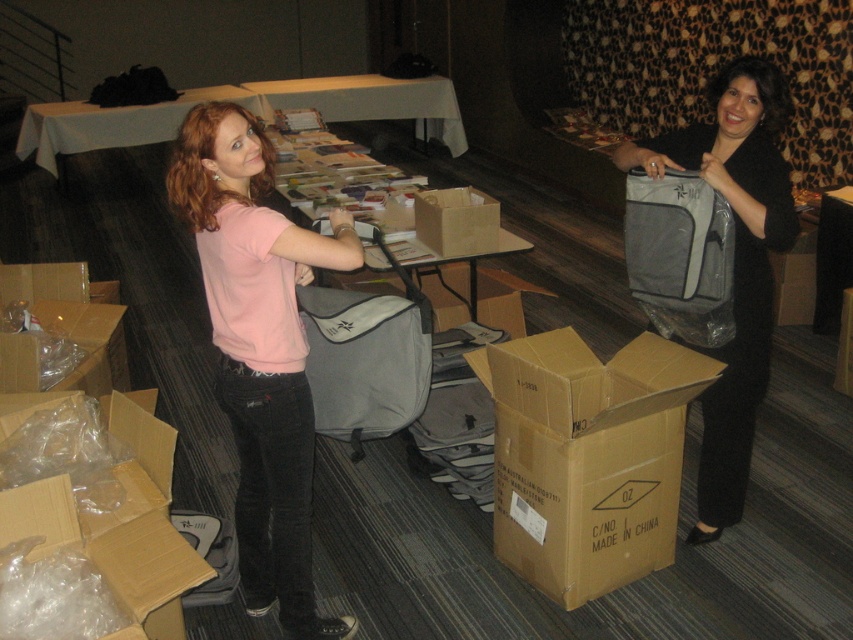
Which is more to the right, matte gray bag at center or gray fabric bag at right?

matte gray bag at center is more to the right.

The image size is (853, 640). I want to click on matte gray bag at center, so click(734, 260).

I want to click on matte gray bag at center, so click(x=734, y=260).

Between pink cotton shirt at center and brown cardboard box at center, which one is positioned higher?

brown cardboard box at center is higher up.

Can you confirm if pink cotton shirt at center is positioned above brown cardboard box at center?

No.

Locate an element on the screen. pink cotton shirt at center is located at coordinates (259, 348).

Does brown cardboard box at lower center lie behind white fabric table at upper center?

No, brown cardboard box at lower center is in front of white fabric table at upper center.

Who is more distant from viewer, (554, 486) or (303, 100)?

Positioned behind is point (303, 100).

Identify the location of brown cardboard box at lower center. The height and width of the screenshot is (640, 853). (587, 456).